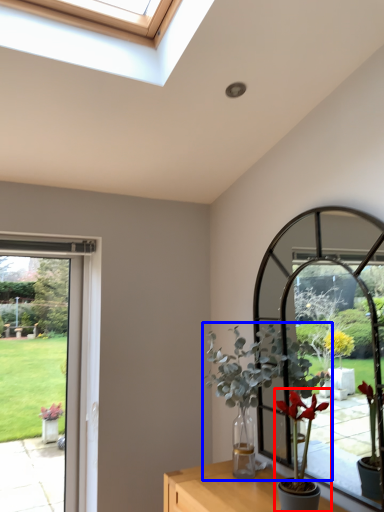
Question: Among these objects, which one is farthest to the camera, houseplant (highlighted by a red box) or houseplant (highlighted by a blue box)?

Choices:
 (A) houseplant
 (B) houseplant

Answer: (B)